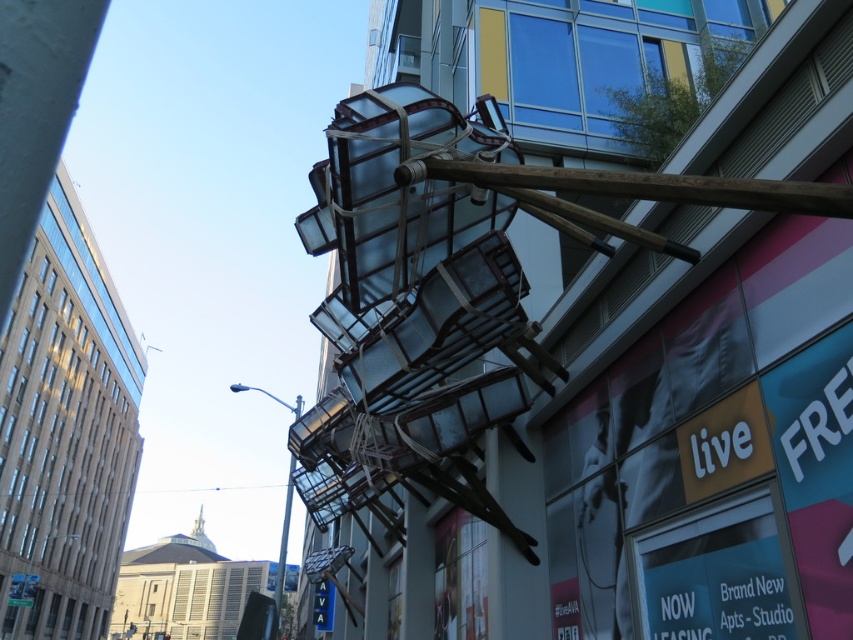
Question: Which point appears closest to the camera in this image?

Choices:
 (A) (300, 403)
 (B) (561, 182)

Answer: (B)

Question: Does wooden pole at upper center appear on the right side of transparent glass pole at upper center?

Choices:
 (A) yes
 (B) no

Answer: (A)

Question: Which point is closer to the camera?

Choices:
 (A) (283, 534)
 (B) (805, 204)

Answer: (B)

Question: Is wooden pole at upper center below transparent glass pole at upper center?

Choices:
 (A) yes
 (B) no

Answer: (B)

Question: Is the position of wooden pole at upper center more distant than that of transparent glass pole at upper center?

Choices:
 (A) no
 (B) yes

Answer: (A)